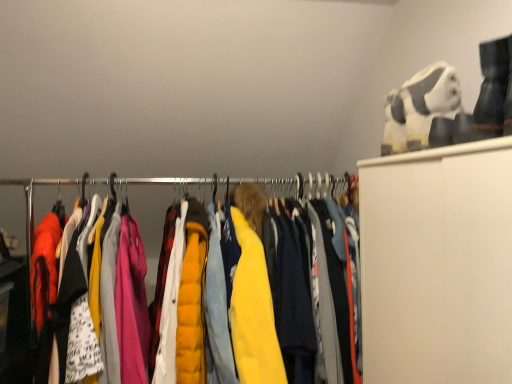
Question: Could you tell me if metallic hangers at center is turned towards yellow quilted jacket at center?

Choices:
 (A) yes
 (B) no

Answer: (A)

Question: Considering the relative sizes of metallic hangers at center and yellow quilted jacket at center in the image provided, is metallic hangers at center thinner than yellow quilted jacket at center?

Choices:
 (A) no
 (B) yes

Answer: (B)

Question: Does metallic hangers at center appear on the right side of yellow quilted jacket at center?

Choices:
 (A) no
 (B) yes

Answer: (A)

Question: Could yellow quilted jacket at center be considered to be inside metallic hangers at center?

Choices:
 (A) no
 (B) yes

Answer: (A)

Question: Is metallic hangers at center behind yellow quilted jacket at center?

Choices:
 (A) yes
 (B) no

Answer: (A)

Question: Is metallic hangers at center in front of yellow quilted jacket at center?

Choices:
 (A) no
 (B) yes

Answer: (A)

Question: From a real-world perspective, is yellow quilted jacket at center over metallic hangers at center?

Choices:
 (A) yes
 (B) no

Answer: (B)

Question: Is yellow quilted jacket at center oriented towards metallic hangers at center?

Choices:
 (A) no
 (B) yes

Answer: (A)

Question: Considering the relative positions of yellow quilted jacket at center and metallic hangers at center in the image provided, is yellow quilted jacket at center to the right of metallic hangers at center from the viewer's perspective?

Choices:
 (A) no
 (B) yes

Answer: (B)

Question: Considering the relative sizes of yellow quilted jacket at center and metallic hangers at center in the image provided, is yellow quilted jacket at center smaller than metallic hangers at center?

Choices:
 (A) no
 (B) yes

Answer: (A)

Question: Is there a large distance between yellow quilted jacket at center and metallic hangers at center?

Choices:
 (A) no
 (B) yes

Answer: (A)

Question: Considering the relative sizes of yellow quilted jacket at center and metallic hangers at center in the image provided, is yellow quilted jacket at center thinner than metallic hangers at center?

Choices:
 (A) yes
 (B) no

Answer: (B)

Question: Is yellow quilted jacket at center inside white plush toy at upper right?

Choices:
 (A) no
 (B) yes

Answer: (A)